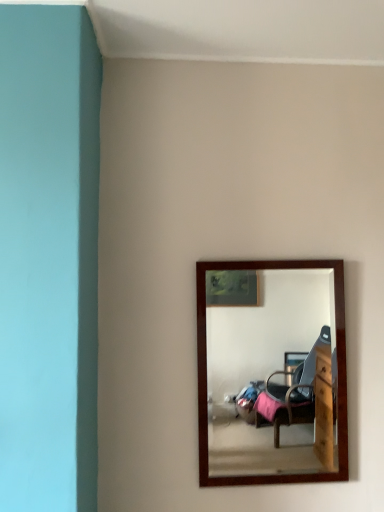
This screenshot has width=384, height=512. What do you see at coordinates (264, 369) in the screenshot? I see `wooden-framed mirror at center` at bounding box center [264, 369].

Find the location of a particular element. wooden-framed mirror at center is located at coordinates (264, 369).

What is the approximate width of wooden-framed mirror at center?

wooden-framed mirror at center is 6.77 centimeters wide.

The width and height of the screenshot is (384, 512). Find the location of `wooden-framed mirror at center`. wooden-framed mirror at center is located at coordinates (264, 369).